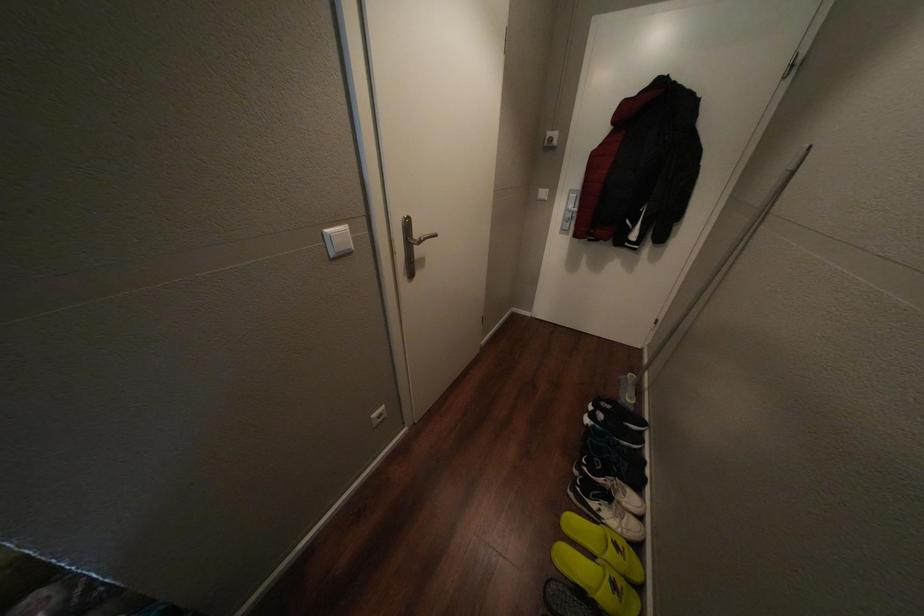
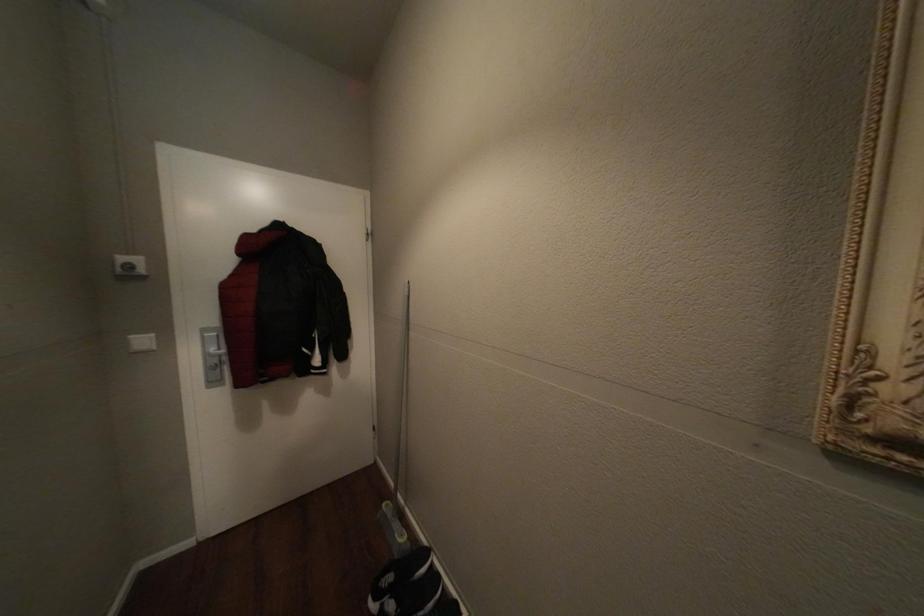
Question: The first image is from the beginning of the video and the second image is from the end. How did the camera likely rotate when shooting the video?

Choices:
 (A) Left
 (B) Right
 (C) Up
 (D) Down

Answer: (B)